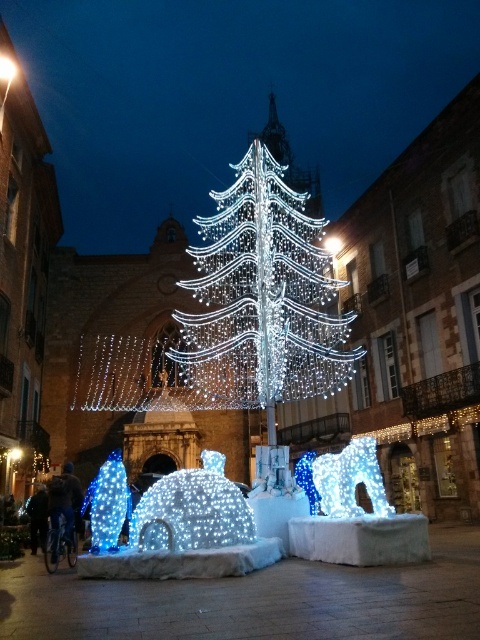
Consider the image. Is illuminated wireframe tree at center thinner than blue led lights at left?

No.

Is point (338, 209) closer to camera compared to point (112, 545)?

That is False.

Locate an element on the screen. This screenshot has height=640, width=480. illuminated wireframe tree at center is located at coordinates (228, 96).

Can you confirm if illuminated wireframe tree at center is positioned to the left of icy white dome at center?

No, illuminated wireframe tree at center is not to the left of icy white dome at center.

Is illuminated wireframe tree at center bigger than icy white dome at center?

Yes, illuminated wireframe tree at center is bigger than icy white dome at center.

Locate an element on the screen. illuminated wireframe tree at center is located at coordinates click(x=228, y=96).

Is icy white sculpture at center to the right of blue led lights at left from the viewer's perspective?

Correct, you'll find icy white sculpture at center to the right of blue led lights at left.

Is icy white sculpture at center thinner than blue led lights at left?

Yes, icy white sculpture at center is thinner than blue led lights at left.

Where is `icy white sculpture at center`? This screenshot has height=640, width=480. icy white sculpture at center is located at coordinates (350, 480).